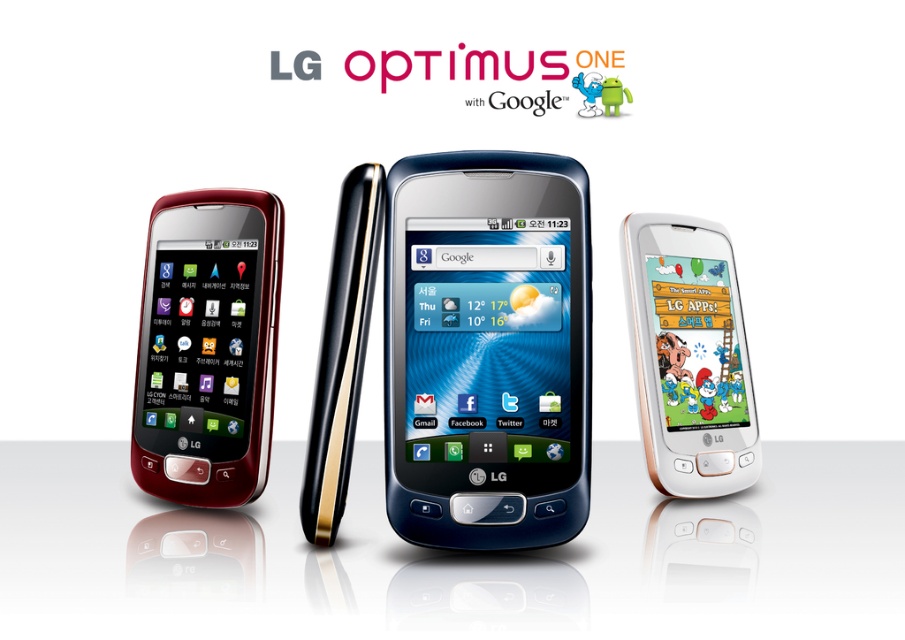
You are a customer looking to buy a phone and see the matte black phone at left and the white glossy smartphone at center. Which one is located more to the left in the image?

The matte black phone at left is positioned on the left side of the white glossy smartphone at center, so it is more to the left.

You are a customer comparing two LG Optimus One smartphones displayed in a store. You see the matte black phone at center and the metallic blue phone at center. Which one do you think is larger?

The matte black phone at center is bigger than the metallic blue phone at center, so the matte black phone at center is larger.